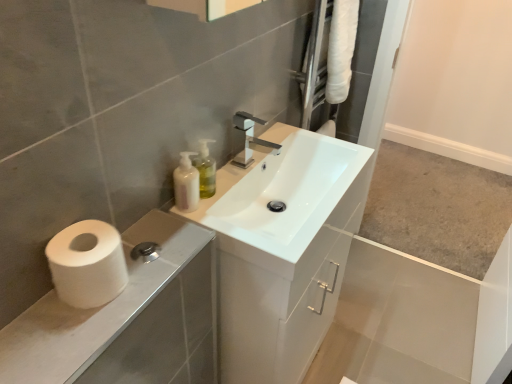
What do you see at coordinates (87, 264) in the screenshot? Image resolution: width=512 pixels, height=384 pixels. I see `white matte toilet paper at lower left` at bounding box center [87, 264].

Identify the location of white glossy sink at center. (284, 192).

What do you see at coordinates (186, 184) in the screenshot?
I see `white matte pump bottle at upper center` at bounding box center [186, 184].

This screenshot has width=512, height=384. I want to click on white glossy cabinet at lower left, so click(x=127, y=319).

This screenshot has height=384, width=512. Identify the location of white matte toilet paper at lower left. (87, 264).

Based on the photo, are white glossy sink at center and white matte pump bottle at upper center beside each other?

white glossy sink at center and white matte pump bottle at upper center are not in contact.

Is white matte pump bottle at upper center located within white glossy sink at center?

Yes, white glossy sink at center contains white matte pump bottle at upper center.

At what (x,y) coordinates should I click in order to perform the action: click on sink below the white matte pump bottle at upper center (from a real-world perspective). Please return your answer as a coordinate pair (x, y). Looking at the image, I should click on (284, 192).

Considering the points (352, 212) and (185, 156), which point is in front, point (352, 212) or point (185, 156)?

The point (185, 156) is more forward.

Can you tell me how much white glossy sink at center and white matte toilet paper at lower left differ in facing direction?

1.53 degrees.

Which is behind, white glossy sink at center or white matte toilet paper at lower left?

white glossy sink at center is more distant.

Which of these two, white glossy sink at center or white matte toilet paper at lower left, stands shorter?

Standing shorter between the two is white matte toilet paper at lower left.

Is white glossy sink at center smaller than white matte toilet paper at lower left?

No, white glossy sink at center is not smaller than white matte toilet paper at lower left.

In terms of width, does white matte pump bottle at upper center look wider or thinner when compared to white matte toilet paper at lower left?

Considering their sizes, white matte pump bottle at upper center looks slimmer than white matte toilet paper at lower left.

You are a GUI agent. You are given a task and a screenshot of the screen. Output one action in this format:
    pyautogui.click(x=<x>, y=<y>)
    Task: Click on the toilet paper that appears on the left of white matte pump bottle at upper center
    The image size is (512, 384).
    Given the screenshot: What is the action you would take?
    pyautogui.click(x=87, y=264)

Which is more to the right, white matte pump bottle at upper center or white matte toilet paper at lower left?

white matte pump bottle at upper center.

Considering the sizes of objects white matte pump bottle at upper center and white matte toilet paper at lower left in the image provided, who is bigger, white matte pump bottle at upper center or white matte toilet paper at lower left?

white matte toilet paper at lower left is bigger.

Is white matte pump bottle at upper center inside the boundaries of white glossy cabinet at lower left, or outside?

white matte pump bottle at upper center lies outside white glossy cabinet at lower left.

Does white matte pump bottle at upper center turn towards white glossy cabinet at lower left?

No, white matte pump bottle at upper center is not turned towards white glossy cabinet at lower left.

Locate an element on the screen. This screenshot has height=384, width=512. bathroom cabinet that is below the white matte pump bottle at upper center (from the image's perspective) is located at coordinates (127, 319).

Between white matte pump bottle at upper center and white glossy cabinet at lower left, which one has smaller size?

white matte pump bottle at upper center.

From the image's perspective, who appears lower, translucent plastic soap dispenser at upper center or white matte toilet paper at lower left?

white matte toilet paper at lower left, from the image's perspective.

Which of these two, translucent plastic soap dispenser at upper center or white matte toilet paper at lower left, stands shorter?

white matte toilet paper at lower left is shorter.

From a real-world perspective, which is physically below, translucent plastic soap dispenser at upper center or white matte toilet paper at lower left?

translucent plastic soap dispenser at upper center, from a real-world perspective.

Which of these two, translucent plastic soap dispenser at upper center or white matte pump bottle at upper center, is bigger?

Bigger between the two is white matte pump bottle at upper center.

In the image, is translucent plastic soap dispenser at upper center positioned in front of or behind white matte pump bottle at upper center?

translucent plastic soap dispenser at upper center is behind white matte pump bottle at upper center.

From the image's perspective, relative to white matte pump bottle at upper center, is translucent plastic soap dispenser at upper center above or below?

From the image's perspective, translucent plastic soap dispenser at upper center appears above white matte pump bottle at upper center.

Measure the distance between translucent plastic soap dispenser at upper center and white matte pump bottle at upper center.

The distance of translucent plastic soap dispenser at upper center from white matte pump bottle at upper center is 3.76 inches.

Is white glossy sink at center inside white glossy cabinet at lower left?

No, white glossy sink at center is located outside of white glossy cabinet at lower left.

Is white glossy cabinet at lower left in contact with white glossy sink at center?

There is a gap between white glossy cabinet at lower left and white glossy sink at center.

Is white glossy cabinet at lower left to the right of white glossy sink at center from the viewer's perspective?

In fact, white glossy cabinet at lower left is to the left of white glossy sink at center.

Image resolution: width=512 pixels, height=384 pixels. In order to click on bathroom cabinet that is below the white glossy sink at center (from the image's perspective) in this screenshot , I will do `click(127, 319)`.

Identify the location of sink located above the white matte pump bottle at upper center (from the image's perspective). The width and height of the screenshot is (512, 384). (284, 192).

Identify the location of toilet paper on the left of white glossy sink at center. This screenshot has height=384, width=512. (87, 264).

Based on their spatial positions, is translucent plastic soap dispenser at upper center or white glossy sink at center closer to white glossy cabinet at lower left?

white glossy sink at center.

Estimate the real-world distances between objects in this image. Which object is closer to white glossy sink at center, white glossy cabinet at lower left or white matte pump bottle at upper center?

Based on the image, white matte pump bottle at upper center appears to be nearer to white glossy sink at center.

Estimate the real-world distances between objects in this image. Which object is closer to translucent plastic soap dispenser at upper center, white matte pump bottle at upper center or white glossy cabinet at lower left?

white matte pump bottle at upper center.

From the image, which object appears to be farther from white matte toilet paper at lower left, white glossy sink at center or white glossy cabinet at lower left?

The object further to white matte toilet paper at lower left is white glossy sink at center.

Which object lies nearer to the anchor point white matte toilet paper at lower left, white glossy sink at center or translucent plastic soap dispenser at upper center?

translucent plastic soap dispenser at upper center is closer to white matte toilet paper at lower left.

Looking at the image, which one is located further to white glossy cabinet at lower left, white matte pump bottle at upper center or white matte toilet paper at lower left?

Based on the image, white matte pump bottle at upper center appears to be further to white glossy cabinet at lower left.

Considering their positions, is white glossy cabinet at lower left positioned further to white glossy sink at center than white matte toilet paper at lower left?

The object further to white glossy sink at center is white matte toilet paper at lower left.

Which object lies nearer to the anchor point white glossy cabinet at lower left, white matte toilet paper at lower left or white matte pump bottle at upper center?

white matte toilet paper at lower left.

Where is `toiletry located between white matte toilet paper at lower left and white glossy sink at center in the left-right direction`? This screenshot has width=512, height=384. toiletry located between white matte toilet paper at lower left and white glossy sink at center in the left-right direction is located at coordinates (186, 184).

Where is `toiletry between white glossy cabinet at lower left and white glossy sink at center from left to right`? toiletry between white glossy cabinet at lower left and white glossy sink at center from left to right is located at coordinates (186, 184).

Find the location of a particular element. sink between white glossy cabinet at lower left and translucent plastic soap dispenser at upper center from front to back is located at coordinates (284, 192).

Where is `toilet paper between white glossy cabinet at lower left and white matte pump bottle at upper center in the front-back direction`? toilet paper between white glossy cabinet at lower left and white matte pump bottle at upper center in the front-back direction is located at coordinates (87, 264).